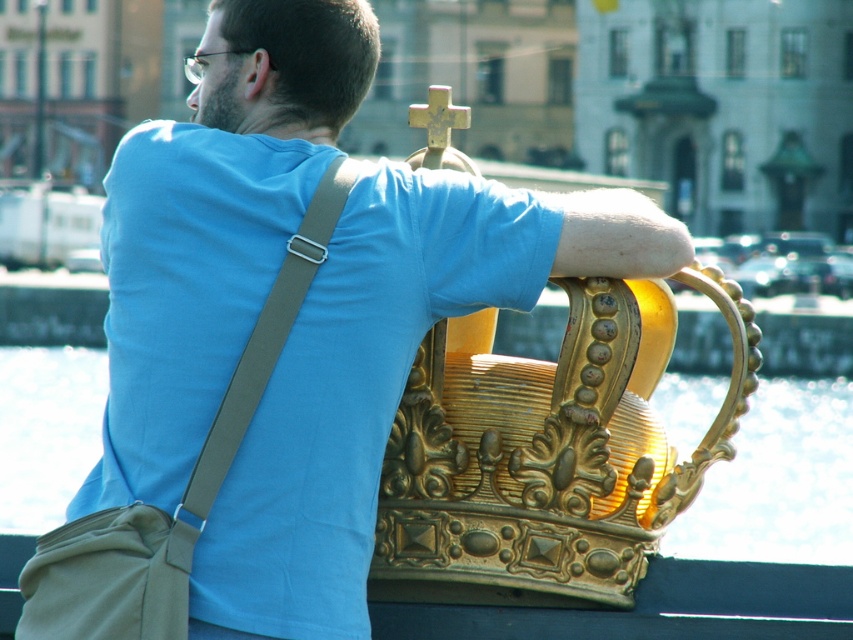
You are standing in a room and see the gold metallic water at upper center. If you want to reach it, would you need to move forward or backward?

The gold metallic water at upper center is 65.50 meters from the viewer, so you would need to move forward to reach it.